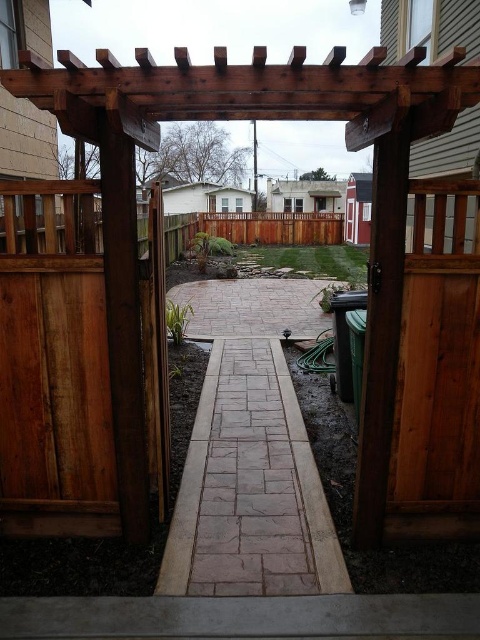
Does brown stone path at center have a smaller size compared to brown wooden fence at center?

Yes, brown stone path at center is smaller than brown wooden fence at center.

Who is more forward, (x=297, y=417) or (x=290, y=236)?

Point (x=297, y=417) is more forward.

Between point (252, 566) and point (208, 224), which one is positioned in front?

Point (252, 566) is in front.

Where is `brown stone path at center`? This screenshot has width=480, height=640. brown stone path at center is located at coordinates point(250,486).